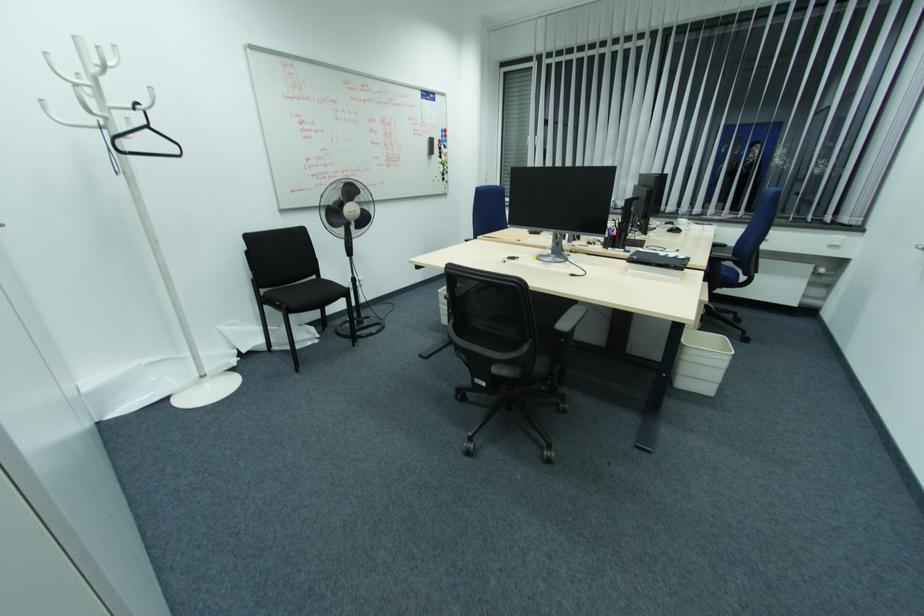
Find where to sit the black office chair sitting surface. Please return your answer as a coordinate pair (x, y).

(517, 351)